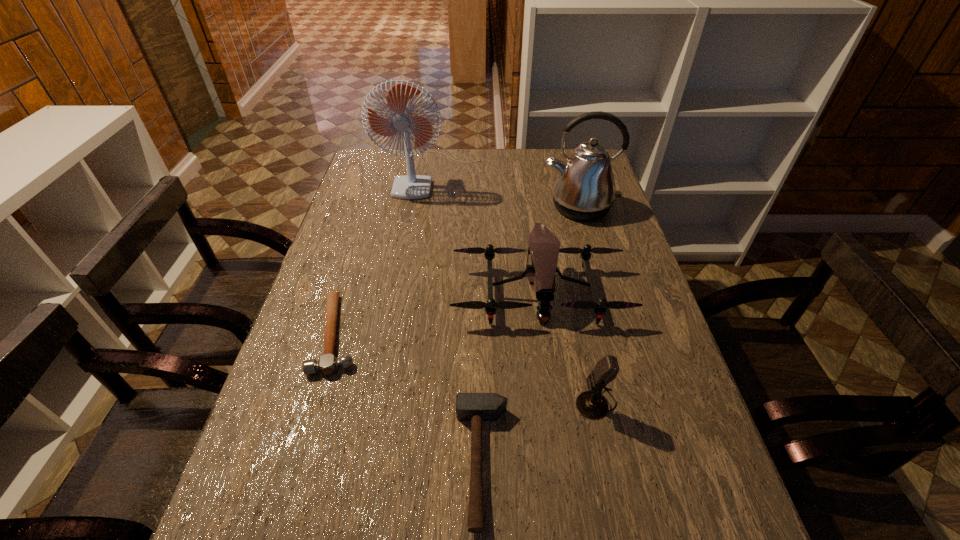
You are a GUI agent. You are given a task and a screenshot of the screen. Output one action in this format:
    pyautogui.click(x=<x>, y=<y>)
    Task: Click on the vacant space located 0.110m on the front-facing side of the drone
    
    Given the screenshot: What is the action you would take?
    pyautogui.click(x=549, y=366)

Find the location of `free location located 0.280m on the front-facing side of the microphone`. free location located 0.280m on the front-facing side of the microphone is located at coordinates (446, 402).

Image resolution: width=960 pixels, height=540 pixels. Find the location of `vacant region located on the front-facing side of the microphone`. vacant region located on the front-facing side of the microphone is located at coordinates (415, 402).

Locate an element on the screen. vacant region located 0.330m on the front-facing side of the microphone is located at coordinates (423, 402).

Find the location of a particular element. free space located 0.380m on the striking surface of the fifth tallest object is located at coordinates (260, 462).

This screenshot has height=540, width=960. What are the coordinates of `vacant space located 0.140m on the striking surface of the fifth tallest object` in the screenshot? It's located at (383, 462).

I want to click on vacant space located on the striking surface of the fifth tallest object, so click(x=363, y=462).

I want to click on vacant area situated 0.140m on the back of the left hammer, so click(360, 261).

Where is `object that is at the far edge`? The image size is (960, 540). object that is at the far edge is located at coordinates (401, 119).

Image resolution: width=960 pixels, height=540 pixels. I want to click on fan located in the left edge section of the desktop, so click(401, 119).